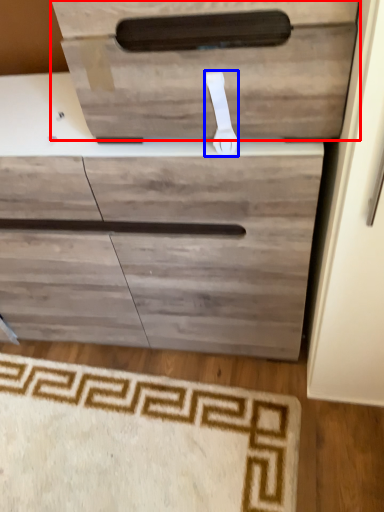
Question: Which object appears farthest to the camera in this image, drawer (highlighted by a red box) or door handle (highlighted by a blue box)?

Choices:
 (A) drawer
 (B) door handle

Answer: (B)